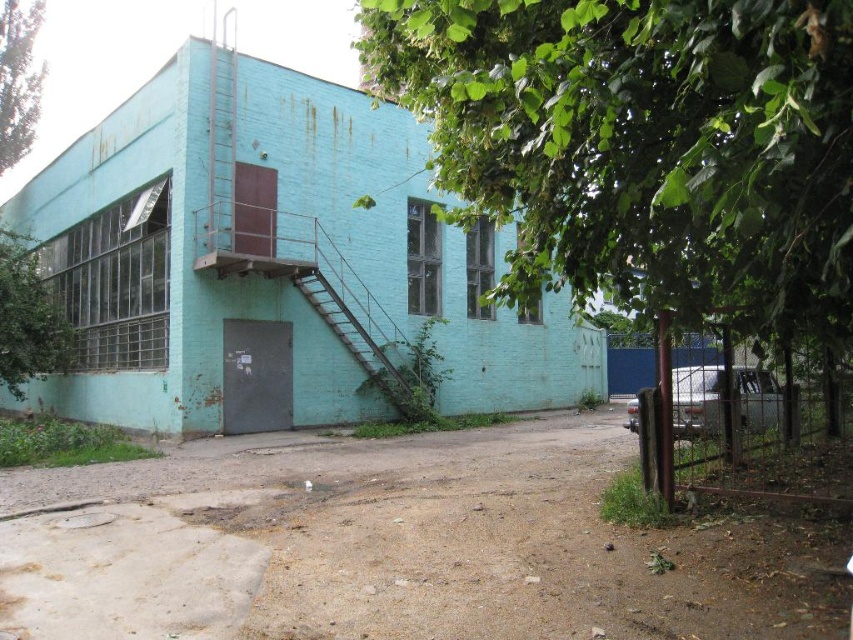
Question: Which point is farther to the camera?

Choices:
 (A) (235, 340)
 (B) (634, 396)

Answer: (B)

Question: Does teal painted wall at upper left appear under metallic teal car at right?

Choices:
 (A) yes
 (B) no

Answer: (B)

Question: Can you confirm if teal painted wall at upper left is wider than metallic teal car at right?

Choices:
 (A) no
 (B) yes

Answer: (B)

Question: Considering the relative positions of teal painted wall at upper left and metallic teal car at right in the image provided, where is teal painted wall at upper left located with respect to metallic teal car at right?

Choices:
 (A) right
 (B) left

Answer: (B)